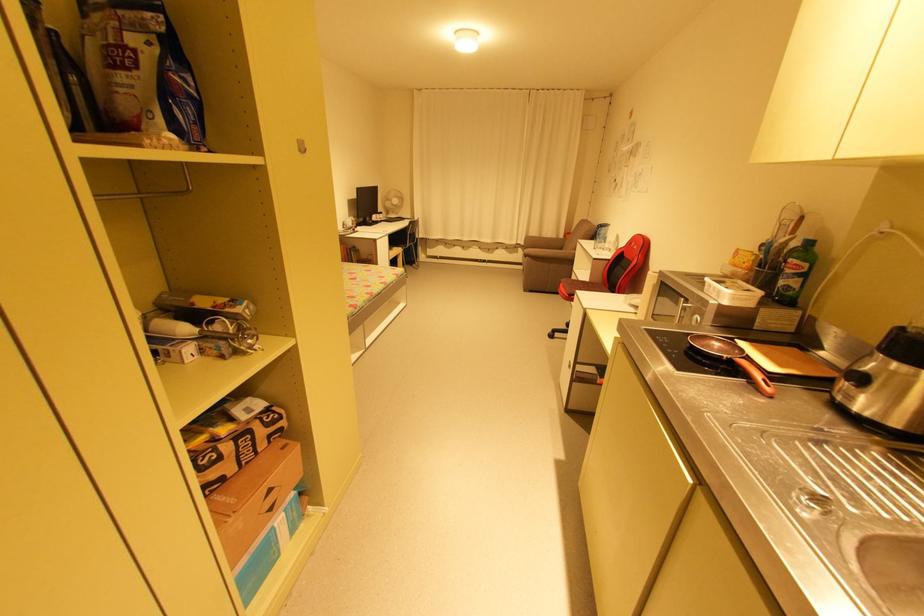
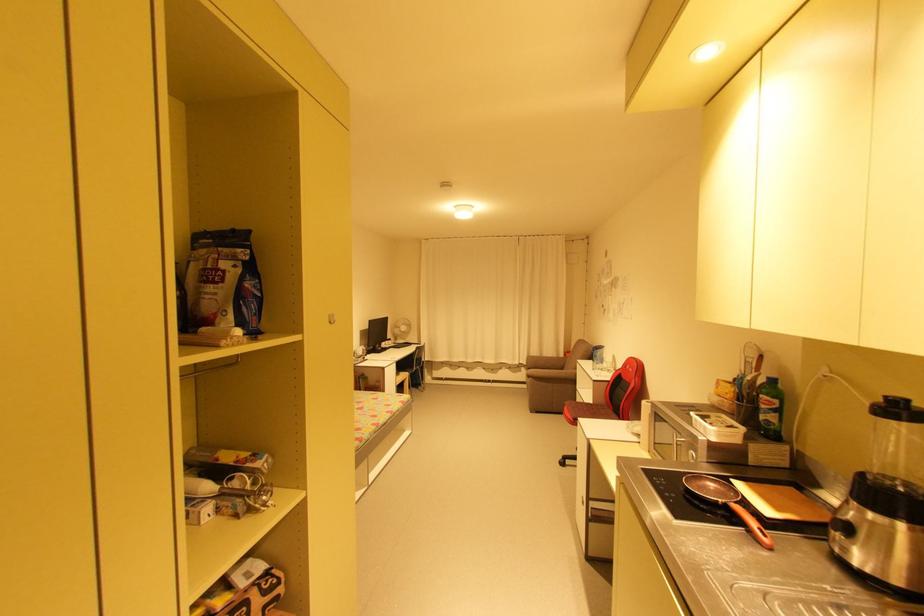
Find the pixel in the second image that matches [752,383] in the first image.

(751, 532)